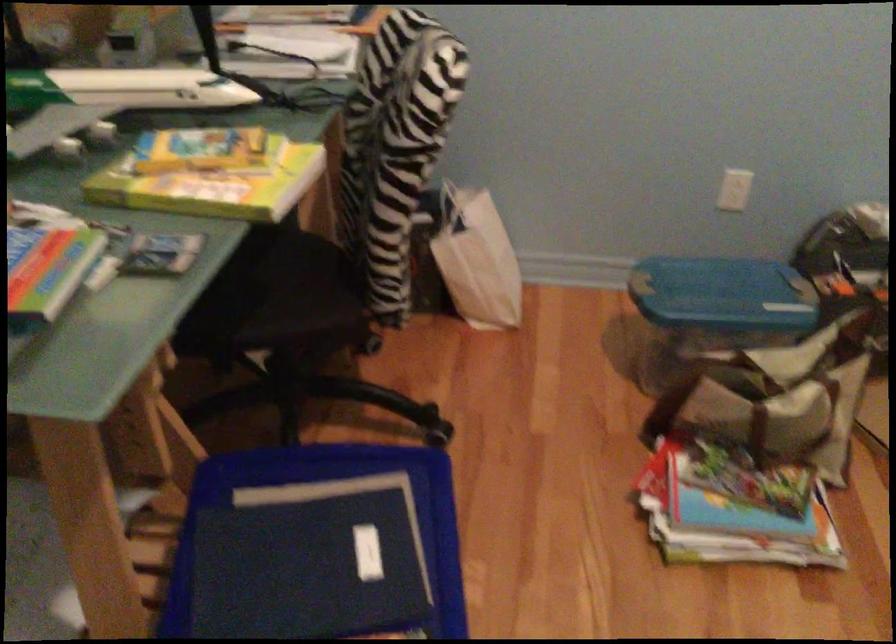
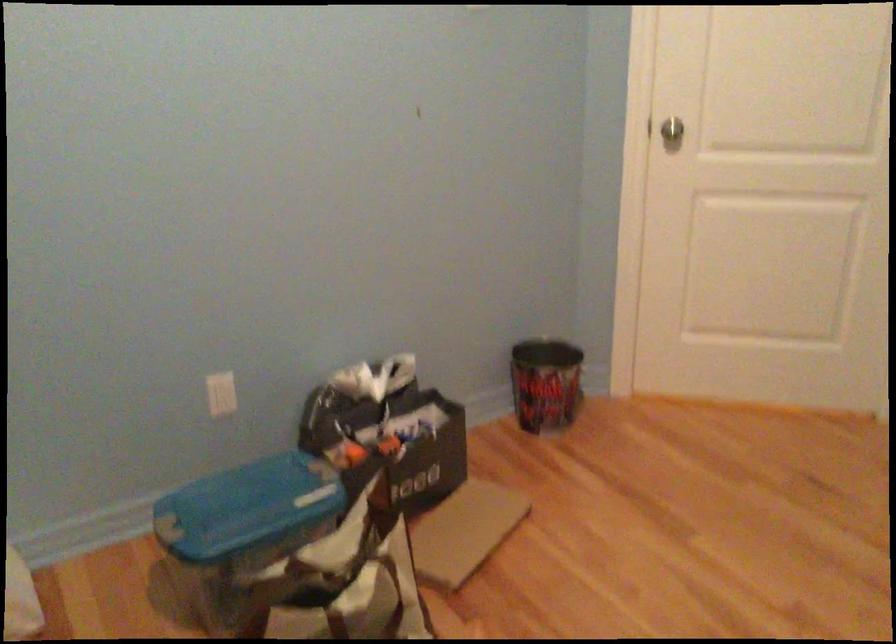
Question: Based on the continuous images, in which direction is the camera rotating? Reply with the corresponding letter.

Choices:
 (A) Left
 (B) Right
 (C) Up
 (D) Down

Answer: (B)